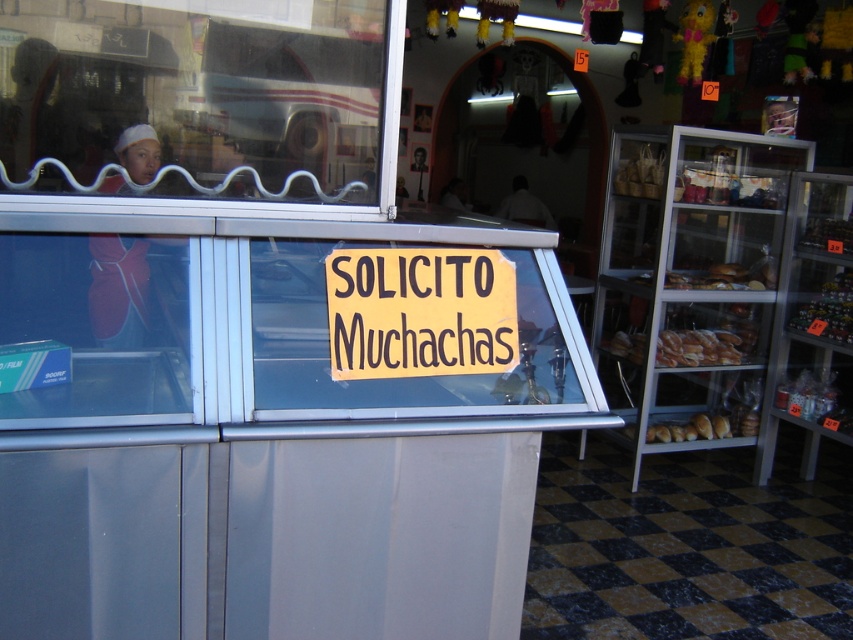
You are standing in front of the shop and want to find the yellow paper sign at center. Based on the coordinates provided, where should you look relative to the shop window?

The yellow paper sign at center is located at the coordinates point [419,310], which is near the center of the shop window.

You are a customer entering the shop and see the yellow paper sign at center and the dark brown bread at right. Which item is positioned lower in the store?

The yellow paper sign at center is positioned lower than the dark brown bread at right because it is located below it.